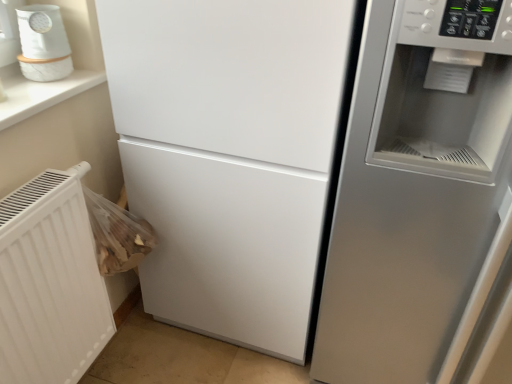
You are a GUI agent. You are given a task and a screenshot of the screen. Output one action in this format:
    pyautogui.click(x=<x>, y=<y>)
    Task: Click on the white glossy humidifier at upper left
    The image size is (512, 384).
    Given the screenshot: What is the action you would take?
    pyautogui.click(x=42, y=32)

The height and width of the screenshot is (384, 512). What do you see at coordinates (50, 282) in the screenshot?
I see `white textured radiator at lower left` at bounding box center [50, 282].

This screenshot has height=384, width=512. What do you see at coordinates (422, 199) in the screenshot?
I see `satin silver fridge at right` at bounding box center [422, 199].

Locate an element on the screen. white glossy humidifier at upper left is located at coordinates click(42, 32).

From the picture: Can you confirm if satin silver fridge at right is taller than white textured radiator at lower left?

Yes, satin silver fridge at right is taller than white textured radiator at lower left.

Looking at the image, does satin silver fridge at right seem bigger or smaller compared to white textured radiator at lower left?

satin silver fridge at right is bigger than white textured radiator at lower left.

Which object is wider, satin silver fridge at right or white textured radiator at lower left?

Wider between the two is satin silver fridge at right.

Image resolution: width=512 pixels, height=384 pixels. I want to click on fridge below the white glossy humidifier at upper left (from a real-world perspective), so pyautogui.click(x=422, y=199).

Is satin silver fridge at right with white glossy humidifier at upper left?

No, satin silver fridge at right is not beside white glossy humidifier at upper left.

Measure the distance between satin silver fridge at right and white glossy humidifier at upper left.

A distance of 3.46 feet exists between satin silver fridge at right and white glossy humidifier at upper left.

Does point (399, 16) come in front of point (60, 28)?

Yes, it is.

The height and width of the screenshot is (384, 512). What are the coordinates of `radiator below the white glossy humidifier at upper left (from a real-world perspective)` in the screenshot? It's located at (50, 282).

In the scene shown: Considering their positions, is white textured radiator at lower left located in front of or behind white glossy humidifier at upper left?

white textured radiator at lower left is in front of white glossy humidifier at upper left.

Based on the photo, is white textured radiator at lower left positioned beyond the bounds of white glossy humidifier at upper left?

Indeed, white textured radiator at lower left is completely outside white glossy humidifier at upper left.

Is point (0, 343) positioned after point (21, 31)?

No, it is not.

Is white glossy humidifier at upper left spatially inside satin silver fridge at right, or outside of it?

white glossy humidifier at upper left exists outside the volume of satin silver fridge at right.

Is white glossy humidifier at upper left bigger or smaller than satin silver fridge at right?

In the image, white glossy humidifier at upper left appears to be smaller than satin silver fridge at right.

Looking at this image, are white glossy humidifier at upper left and satin silver fridge at right located far from each other?

Yes, white glossy humidifier at upper left and satin silver fridge at right are located far from each other.

Considering the positions of objects white glossy humidifier at upper left and satin silver fridge at right in the image provided, who is behind, white glossy humidifier at upper left or satin silver fridge at right?

white glossy humidifier at upper left is further away from the camera.

What's the angular difference between white glossy humidifier at upper left and white textured radiator at lower left's facing directions?

3.98 degrees separate the facing orientations of white glossy humidifier at upper left and white textured radiator at lower left.

In terms of height, does white glossy humidifier at upper left look taller or shorter compared to white textured radiator at lower left?

Considering their sizes, white glossy humidifier at upper left has less height than white textured radiator at lower left.

Is white glossy humidifier at upper left facing towards white textured radiator at lower left?

No.

Between white glossy humidifier at upper left and white textured radiator at lower left, which one appears on the right side from the viewer's perspective?

white textured radiator at lower left.

Is white textured radiator at lower left in front of or behind satin silver fridge at right in the image?

Clearly, white textured radiator at lower left is behind satin silver fridge at right.

Is there a large distance between white textured radiator at lower left and satin silver fridge at right?

That's not correct — white textured radiator at lower left is a little close to satin silver fridge at right.

From a real-world perspective, does white textured radiator at lower left sit lower than satin silver fridge at right?

Correct, in the physical world, white textured radiator at lower left is lower than satin silver fridge at right.

Who is taller, white textured radiator at lower left or satin silver fridge at right?

Standing taller between the two is satin silver fridge at right.

I want to click on fridge in front of the white textured radiator at lower left, so click(422, 199).

Image resolution: width=512 pixels, height=384 pixels. Identify the location of appliance above the satin silver fridge at right (from the image's perspective). (42, 32).

When comparing their distances from satin silver fridge at right, does white textured radiator at lower left or white glossy humidifier at upper left seem closer?

white textured radiator at lower left is closer to satin silver fridge at right.

When comparing their distances from satin silver fridge at right, does white glossy humidifier at upper left or white textured radiator at lower left seem further?

white glossy humidifier at upper left lies further to satin silver fridge at right than the other object.

Which object lies nearer to the anchor point white glossy humidifier at upper left, satin silver fridge at right or white textured radiator at lower left?

white textured radiator at lower left lies closer to white glossy humidifier at upper left than the other object.

Looking at the image, which one is located further to white glossy humidifier at upper left, white textured radiator at lower left or satin silver fridge at right?

satin silver fridge at right is positioned further to the anchor white glossy humidifier at upper left.

When comparing their distances from white textured radiator at lower left, does white glossy humidifier at upper left or satin silver fridge at right seem closer?

white glossy humidifier at upper left is closer to white textured radiator at lower left.

Consider the image. Looking at the image, which one is located further to white textured radiator at lower left, satin silver fridge at right or white glossy humidifier at upper left?

The object further to white textured radiator at lower left is satin silver fridge at right.

You are a GUI agent. You are given a task and a screenshot of the screen. Output one action in this format:
    pyautogui.click(x=<x>, y=<y>)
    Task: Click on the radiator between white glossy humidifier at upper left and satin silver fridge at right in the horizontal direction
    
    Given the screenshot: What is the action you would take?
    pyautogui.click(x=50, y=282)